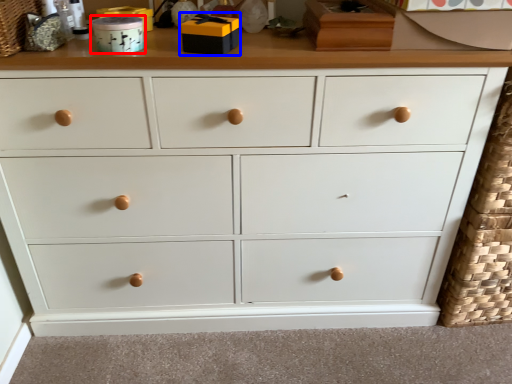
Question: Which object is closer to the camera taking this photo, toy (highlighted by a red box) or toy (highlighted by a blue box)?

Choices:
 (A) toy
 (B) toy

Answer: (B)